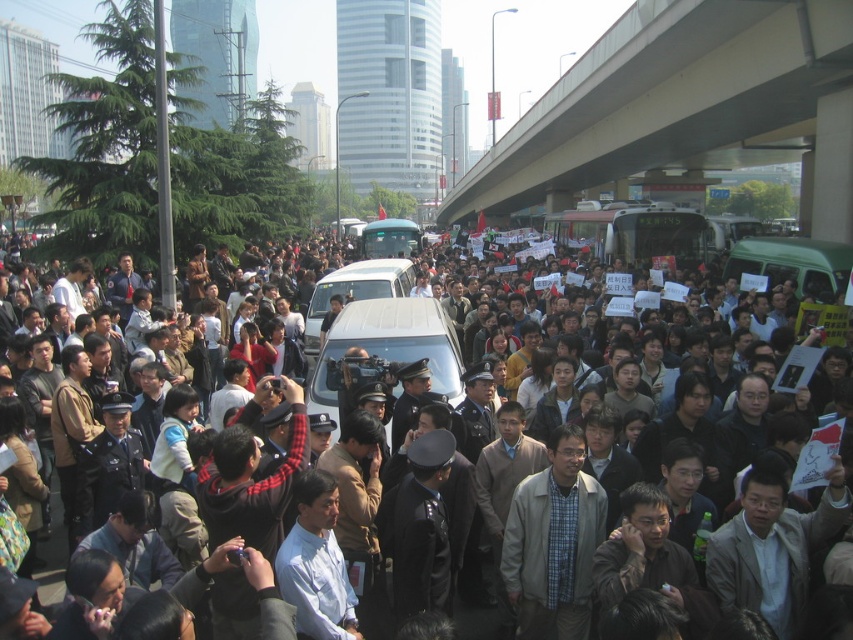
Question: Is concrete bridge at upper right above dark gray uniformed officers at center?

Choices:
 (A) no
 (B) yes

Answer: (B)

Question: Which point is closer to the camera taking this photo?

Choices:
 (A) (660, 150)
 (B) (252, 410)

Answer: (B)

Question: Among these objects, which one is nearest to the camera?

Choices:
 (A) dark gray uniformed officers at center
 (B) concrete bridge at upper right

Answer: (A)

Question: Is concrete bridge at upper right to the left of dark gray uniformed officers at center from the viewer's perspective?

Choices:
 (A) yes
 (B) no

Answer: (B)

Question: Is concrete bridge at upper right above dark gray uniformed officers at center?

Choices:
 (A) no
 (B) yes

Answer: (B)